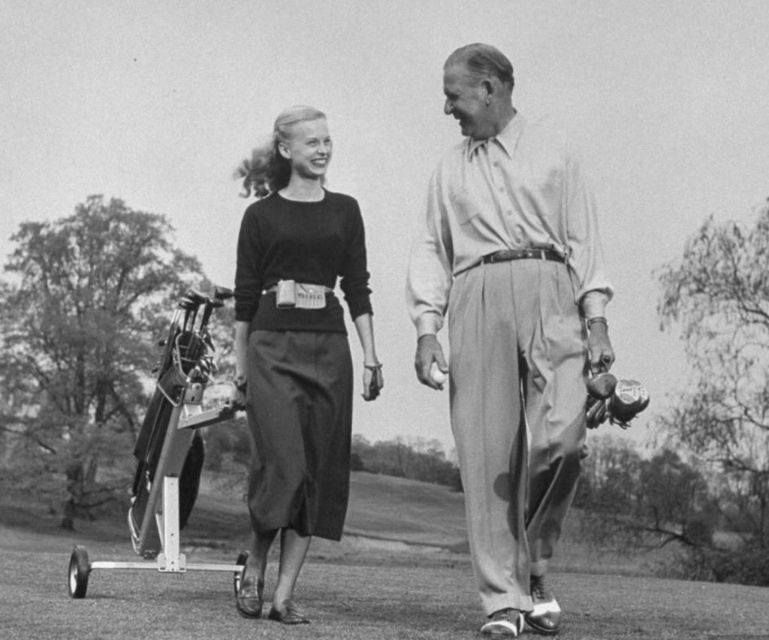
Question: Which point is farther from the camera taking this photo?

Choices:
 (A) coord(518,333)
 (B) coord(285,401)

Answer: (B)

Question: In this image, where is light beige cotton pants at center located relative to matte black sweater at center?

Choices:
 (A) left
 (B) right

Answer: (B)

Question: Can you confirm if light beige cotton pants at center is positioned to the left of matte black sweater at center?

Choices:
 (A) no
 (B) yes

Answer: (A)

Question: In this image, where is light beige cotton pants at center located relative to matte black sweater at center?

Choices:
 (A) right
 (B) left

Answer: (A)